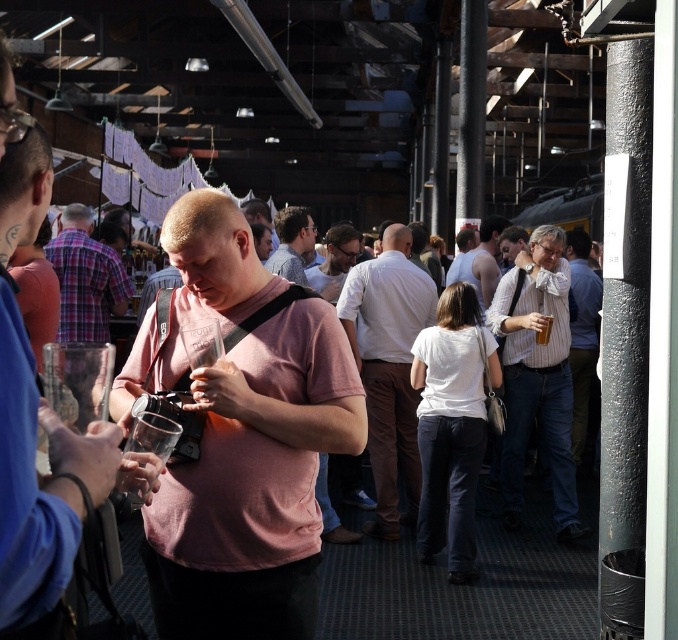
Question: Observing the image, what is the correct spatial positioning of pink matte shirt at center in reference to pink cotton shirt at center?

Choices:
 (A) right
 (B) left

Answer: (A)

Question: Can you confirm if plaid fabric shirt at center is wider than matte pink shirt at center?

Choices:
 (A) no
 (B) yes

Answer: (B)

Question: Which object appears closest to the camera in this image?

Choices:
 (A) white striped shirt at right
 (B) white cotton shirt at center

Answer: (B)

Question: Considering the real-world distances, which object is farthest from the white striped shirt at right?

Choices:
 (A) pink cotton shirt at center
 (B) plaid fabric shirt at center

Answer: (A)

Question: Does pink matte shirt at center appear on the left side of white cotton shirt at center?

Choices:
 (A) yes
 (B) no

Answer: (A)

Question: Which object appears farthest from the camera in this image?

Choices:
 (A) matte pink shirt at center
 (B) skinny white tank top at center

Answer: (B)